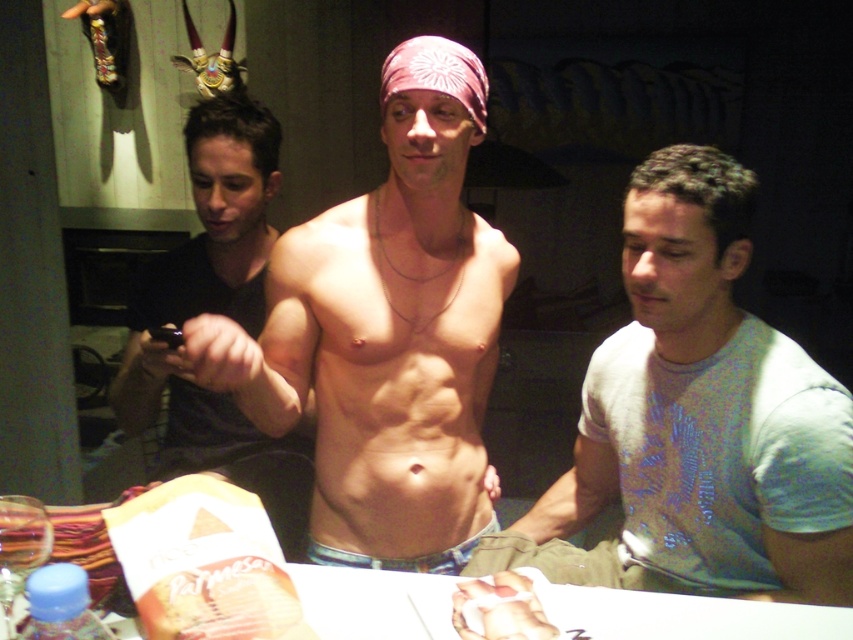
You are a photographer adjusting your camera settings. You notice two points in the image at coordinates point (393,312) and point (764,588). Which point is nearer to your camera lens?

Point (393,312) is closer to the viewer than point (764,588), so the first point is nearer to the camera lens.

You are a photographer adjusting lighting for a shoot. You need to ensure that the smooth skin torso at center and the white glossy table at center are both well lit. Given their height difference, which object should you position the light closer to to achieve balanced illumination?

The smooth skin torso at center is taller than the white glossy table at center. To achieve balanced illumination, position the light closer to the white glossy table at center since it is shorter and requires less distance for even lighting.

You are a photographer trying to capture a group photo of the individuals at the table. Since the light blue cotton shirt at center and the smooth skin torso at center are both in the frame, which one do you think will appear larger in the final photo?

The smooth skin torso at center appears larger than the light blue cotton shirt at center in the image, so it will look bigger in the photo.